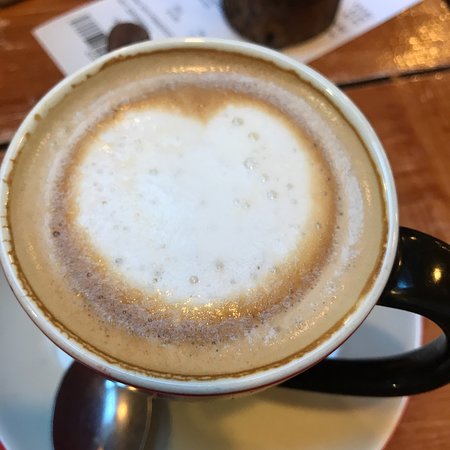
You are a GUI agent. You are given a task and a screenshot of the screen. Output one action in this format:
    pyautogui.click(x=<x>, y=<y>)
    Task: Click on the light gray shadow on saucer
    
    Given the screenshot: What is the action you would take?
    pyautogui.click(x=191, y=429)